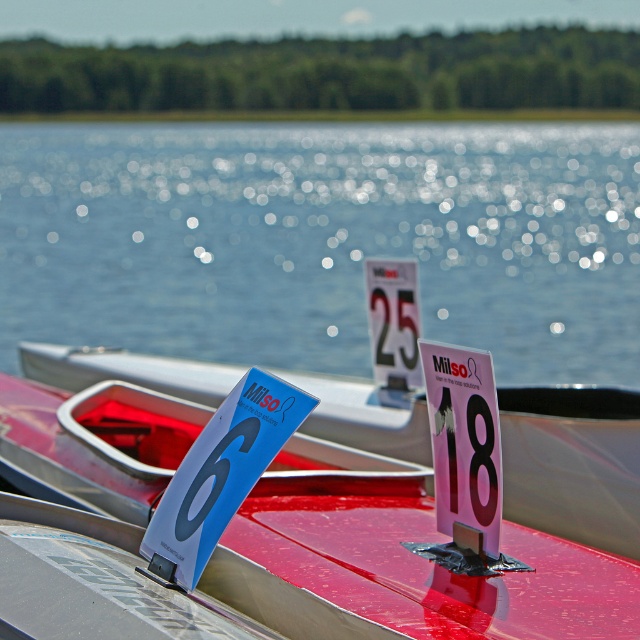
Does pink paper at center appear over black glossy number at center?

Actually, pink paper at center is below black glossy number at center.

How far apart are pink paper at center and black glossy number at center?

The distance of pink paper at center from black glossy number at center is 5.42 inches.

Locate an element on the screen. pink paper at center is located at coordinates (481, 460).

Which is more to the left, glistening water at center or pink paper at center?

Positioned to the left is glistening water at center.

Describe the element at coordinates (324, 241) in the screenshot. I see `glistening water at center` at that location.

Find the location of a particular element. The height and width of the screenshot is (640, 640). glistening water at center is located at coordinates (324, 241).

Does glistening water at center come behind blue glossy sign at center?

Yes.

Between glistening water at center and blue glossy sign at center, which one appears on the right side from the viewer's perspective?

blue glossy sign at center

Is point (420, 234) positioned before point (211, 493)?

No.

This screenshot has width=640, height=640. In order to click on glistening water at center in this screenshot , I will do `click(324, 241)`.